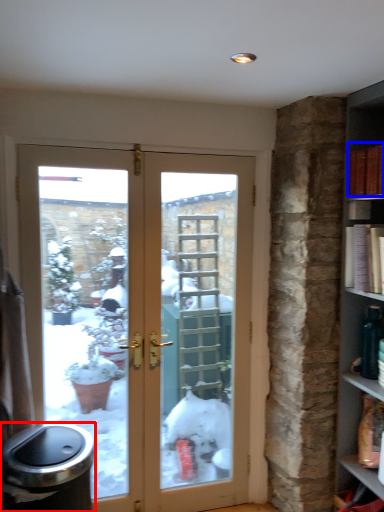
Question: Which object appears farthest to the camera in this image, garbage (highlighted by a red box) or book (highlighted by a blue box)?

Choices:
 (A) garbage
 (B) book

Answer: (B)